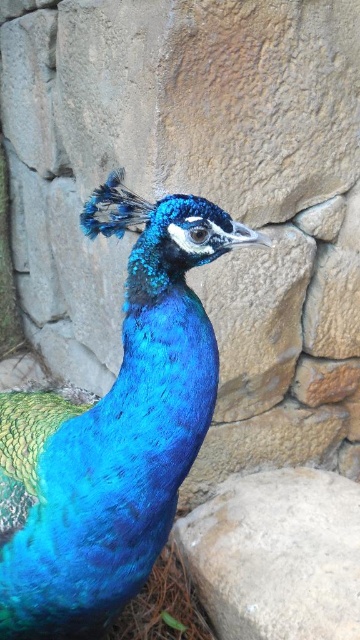
Question: Where is shiny blue peacock at center located in relation to gray rough stone at center in the image?

Choices:
 (A) left
 (B) right

Answer: (A)

Question: Which object appears farthest from the camera in this image?

Choices:
 (A) blue glossy feathers at upper center
 (B) shiny blue peacock at center

Answer: (A)

Question: Among these points, which one is farthest from the camera?

Choices:
 (A) [150, 253]
 (B) [209, 566]
 (C) [105, 227]

Answer: (B)

Question: Does shiny blue peacock at center appear under blue glossy feathers at upper center?

Choices:
 (A) yes
 (B) no

Answer: (A)

Question: Where is shiny blue peacock at center located in relation to blue glossy feathers at upper center in the image?

Choices:
 (A) left
 (B) right

Answer: (B)

Question: Which of the following is the farthest from the observer?

Choices:
 (A) (203, 580)
 (B) (75, 621)
 (C) (113, 189)

Answer: (A)